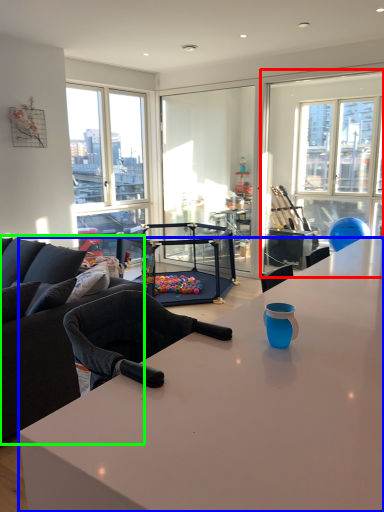
Question: Which object is the farthest from window screen (highlighted by a red box)? Choose among these: desk (highlighted by a blue box) or studio couch (highlighted by a green box).

Choices:
 (A) desk
 (B) studio couch

Answer: (A)